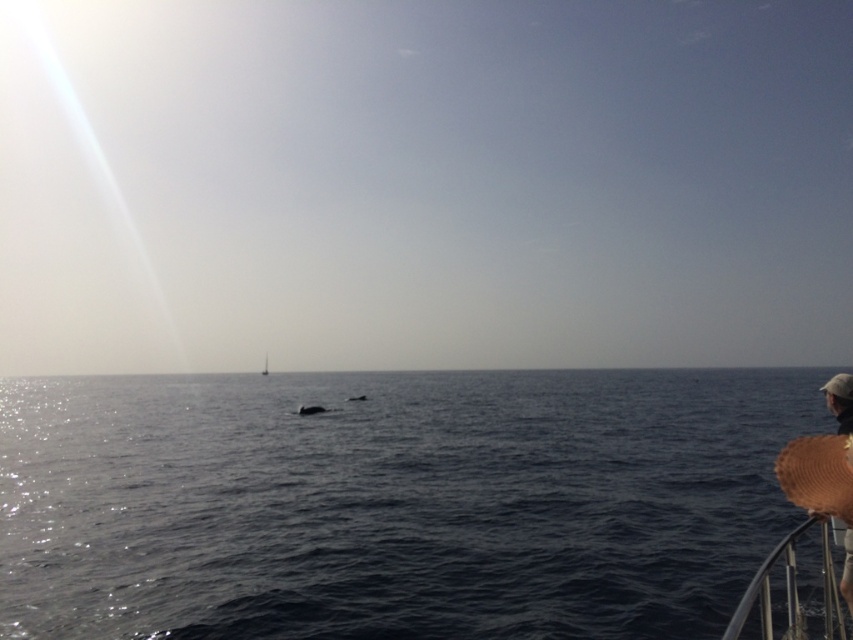
Question: Which of the following is the closest to the observer?

Choices:
 (A) click(x=838, y=387)
 (B) click(x=647, y=568)
 (C) click(x=263, y=376)

Answer: (A)

Question: Considering the relative positions of brown woven hat at lower right and brown straw hat at lower right in the image provided, where is brown woven hat at lower right located with respect to brown straw hat at lower right?

Choices:
 (A) below
 (B) above

Answer: (B)

Question: Can you confirm if dark blue water at center is thinner than brown woven hat at lower right?

Choices:
 (A) no
 (B) yes

Answer: (A)

Question: Does brown woven hat at lower right have a greater width compared to white plastic boat at center?

Choices:
 (A) yes
 (B) no

Answer: (B)

Question: Which point is farther from the camera taking this photo?

Choices:
 (A) (840, 444)
 (B) (848, 388)

Answer: (B)

Question: Which of the following is the farthest from the observer?

Choices:
 (A) brown woven hat at lower right
 (B) brown straw hat at lower right

Answer: (B)